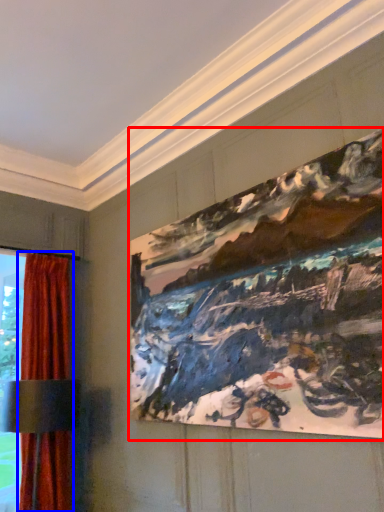
Question: Which object appears closest to the camera in this image, picture frame (highlighted by a red box) or curtain (highlighted by a blue box)?

Choices:
 (A) picture frame
 (B) curtain

Answer: (A)